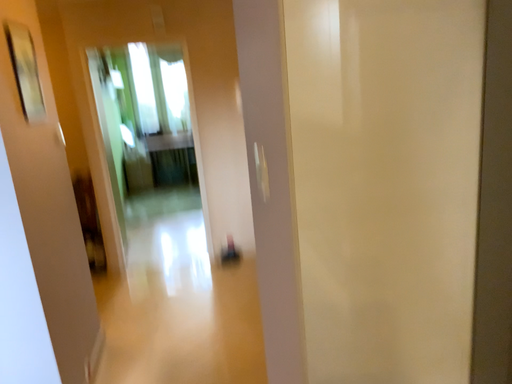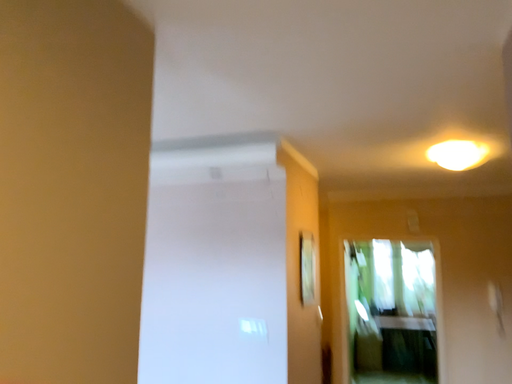
Question: How did the camera likely rotate when shooting the video?

Choices:
 (A) rotated right
 (B) rotated left

Answer: (B)